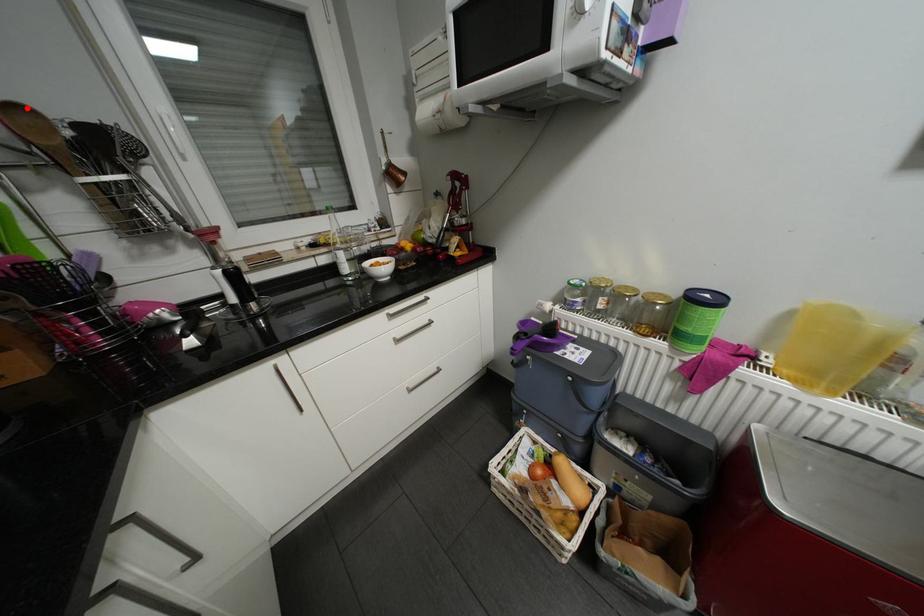
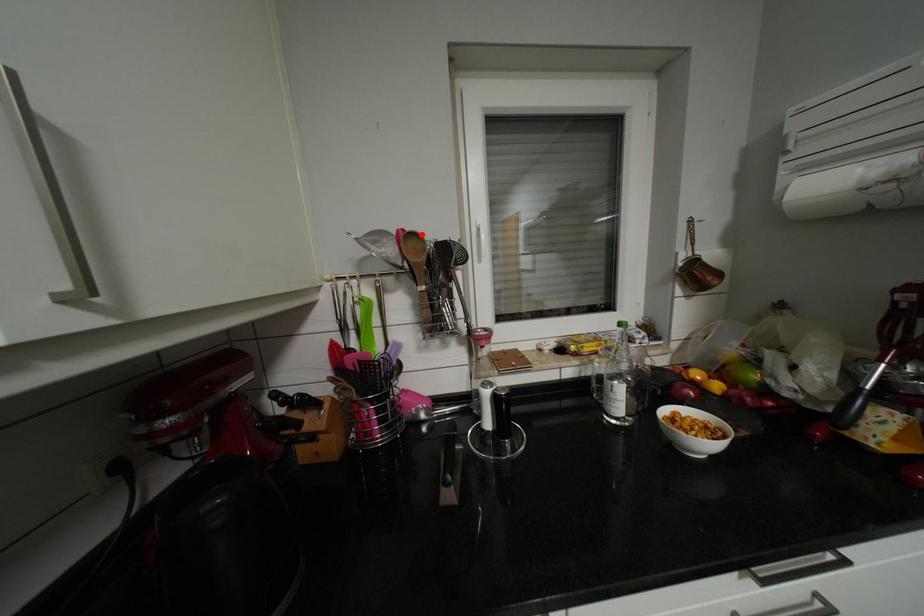
I am providing you with two images of the same scene from different viewpoints. A red point is marked on the first image and another point is marked on the second image. Is the marked point in image1 the same physical position as the marked point in image2?

Yes